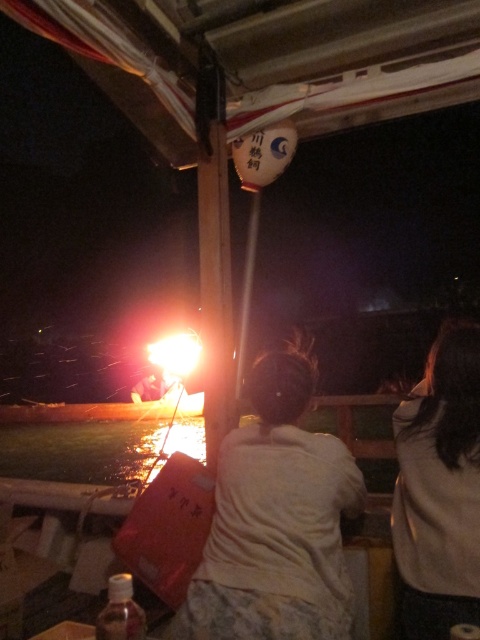
You are standing at the point marked as point (276, 520) in the image. What is the nearest object to you?

The nearest object to you at point (276, 520) is the white cotton shirt at center.

You are at a nighttime gathering and see two people sitting facing away from you. One has a white cotton shirt at center and the other has light brown hair at center. Which person is sitting to the left of the other?

The white cotton shirt at center is positioned on the left side of light brown hair at center, so the person with the white cotton shirt at center is sitting to the left of the person with light brown hair at center.